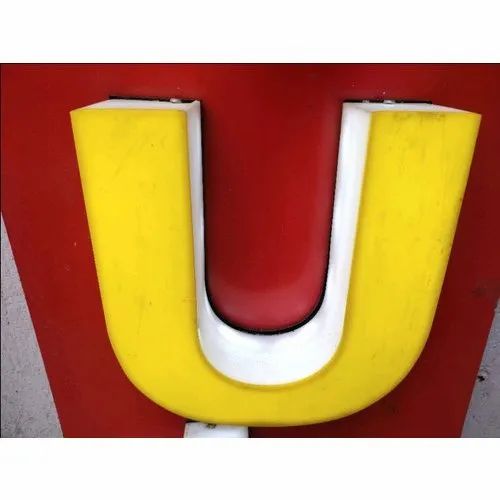
Where is `hole in wall`? The width and height of the screenshot is (500, 500). hole in wall is located at coordinates (482, 377).